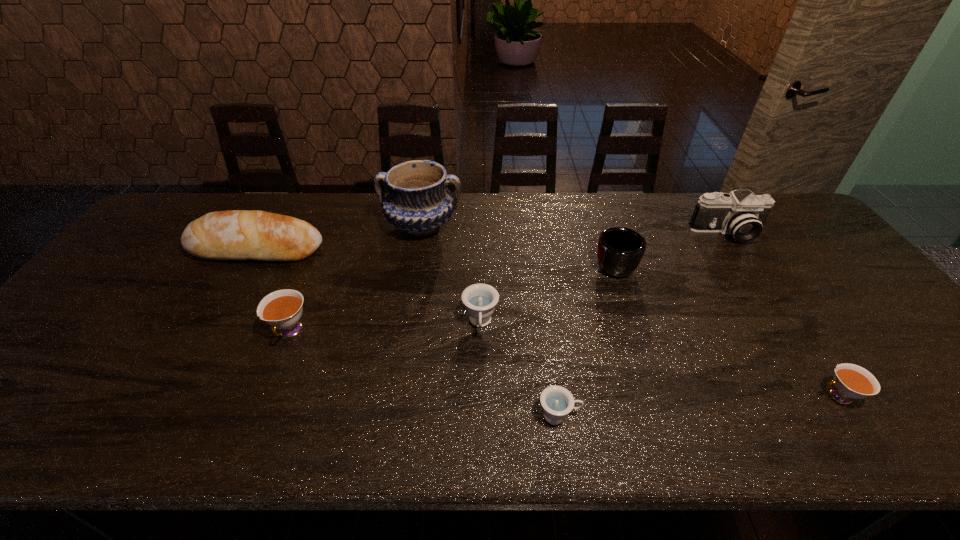
At what (x,y) coordinates should I click in order to perform the action: click on free space at the far edge of the desktop. Please return your answer as a coordinate pair (x, y). Looking at the image, I should click on (517, 227).

The width and height of the screenshot is (960, 540). Find the location of `blank space at the near edge of the desktop`. blank space at the near edge of the desktop is located at coordinates (254, 417).

This screenshot has height=540, width=960. I want to click on vacant space at the left edge of the desktop, so click(162, 265).

In order to click on free location at the right edge in this screenshot , I will do `click(857, 341)`.

Identify the location of free region at the far left corner of the desktop. The width and height of the screenshot is (960, 540). (211, 193).

I want to click on vacant space that's between the red mug and the tallest object, so click(x=517, y=244).

This screenshot has height=540, width=960. I want to click on empty space that is in between the black camera and the bigger blue teacup, so click(x=604, y=278).

At what (x,y) coordinates should I click in order to perform the action: click on free space between the nearer blue teacup and the rightmost teacup. Please return your answer as a coordinate pair (x, y). Image resolution: width=960 pixels, height=540 pixels. Looking at the image, I should click on (698, 406).

Locate an element on the screen. Image resolution: width=960 pixels, height=540 pixels. unoccupied area between the bigger blue teacup and the right white teacup is located at coordinates (660, 360).

Where is `vacant space in between the rightmost teacup and the leftmost teacup`? The image size is (960, 540). vacant space in between the rightmost teacup and the leftmost teacup is located at coordinates (564, 364).